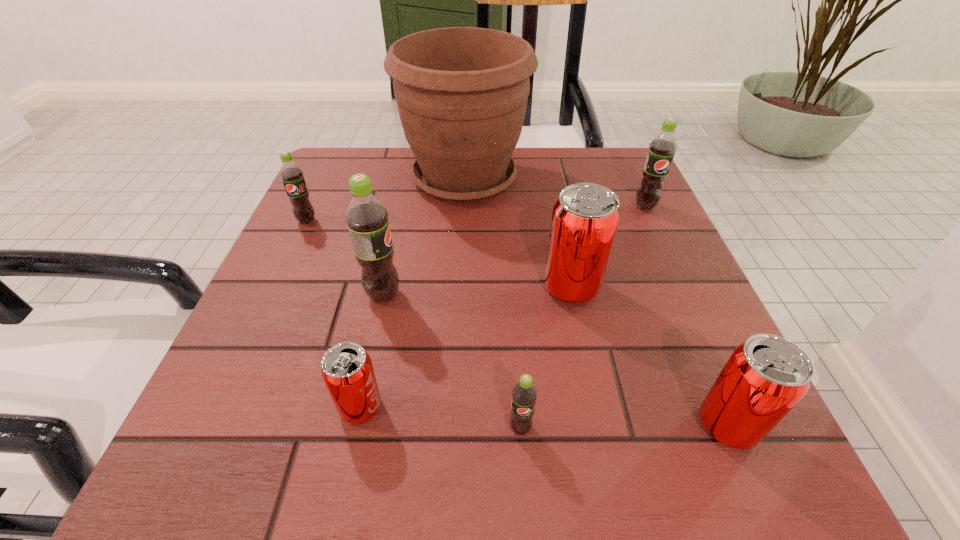
At what (x,y) coordinates should I click in order to perform the action: click on unoccupied position between the smallest green soda and the tallest object. Please return your answer as a coordinate pair (x, y). The image size is (960, 540). Looking at the image, I should click on (492, 303).

Where is `free area in between the fourth soda from left to right and the tallest object`? free area in between the fourth soda from left to right and the tallest object is located at coordinates point(492,303).

Find the location of a particular element. The height and width of the screenshot is (540, 960). empty space between the rightmost green soda and the seventh shortest object is located at coordinates 515,251.

This screenshot has width=960, height=540. What are the coordinates of `vacant space that is in between the flowerpot and the farthest red soda can` in the screenshot? It's located at (517, 233).

Identify the location of blank region between the leftmost red soda can and the farthest soda. The height and width of the screenshot is (540, 960). (503, 307).

Where is `unoccupied area between the leftmost soda and the smallest green soda`? unoccupied area between the leftmost soda and the smallest green soda is located at coordinates (414, 325).

Identify the location of vacant area that lies between the flowerpot and the smallest red soda can. [x=413, y=293].

Locate an element on the screen. This screenshot has height=540, width=960. vacant point located between the nearest green soda and the second smallest green soda is located at coordinates (414, 325).

You are a GUI agent. You are given a task and a screenshot of the screen. Output one action in this format:
    pyautogui.click(x=<x>, y=<y>)
    Task: Click on the free space between the flowerpot and the farthest soda
    
    Given the screenshot: What is the action you would take?
    pyautogui.click(x=555, y=193)

Locate an element on the screen. The width and height of the screenshot is (960, 540). object that is the seventh nearest to the second red soda can from right to left is located at coordinates (291, 174).